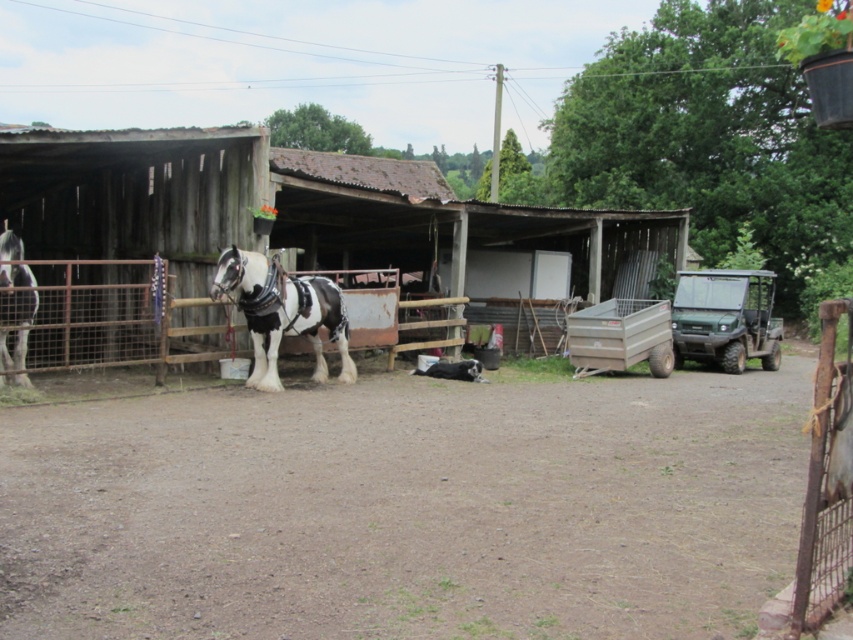
Is weathered wood barn at center smaller than spotted glossy horse at left?

Incorrect, weathered wood barn at center is not smaller in size than spotted glossy horse at left.

Which is behind, point (88, 189) or point (12, 244)?

The point (88, 189) is behind.

At what (x,y) coordinates should I click in order to perform the action: click on weathered wood barn at center. Please return your answer as a coordinate pair (x, y). The image size is (853, 640). Looking at the image, I should click on (305, 212).

Does spotted glossy horse at center have a greater height compared to spotted glossy horse at left?

No, spotted glossy horse at center is not taller than spotted glossy horse at left.

Can you confirm if spotted glossy horse at center is wider than spotted glossy horse at left?

Indeed, spotted glossy horse at center has a greater width compared to spotted glossy horse at left.

Is point (267, 266) more distant than point (21, 374)?

Yes, it is behind point (21, 374).

Identify the location of spotted glossy horse at center. (282, 312).

Who is lower down, weathered wood barn at center or spotted glossy horse at center?

spotted glossy horse at center

Is point (20, 225) in front of point (315, 362)?

No, it is behind (315, 362).

Is point (386, 205) positioned behind point (264, 280)?

Yes, it is.

Find the location of a particular element. weathered wood barn at center is located at coordinates (305, 212).